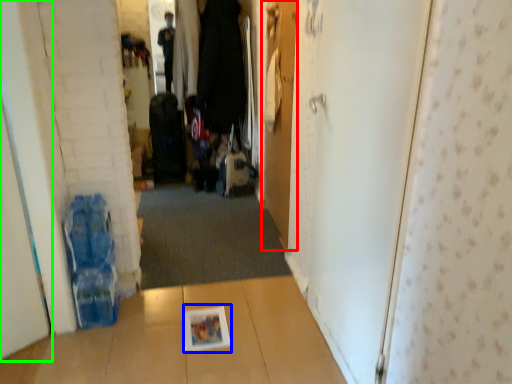
Question: Which is farther away from door (highlighted by a red box)? magazine (highlighted by a blue box) or door (highlighted by a green box)?

Choices:
 (A) magazine
 (B) door

Answer: (B)